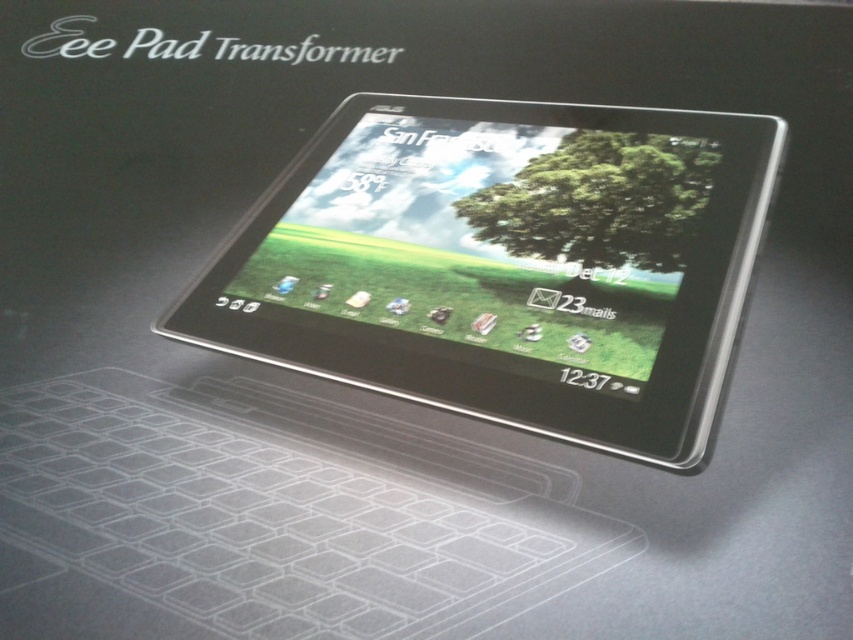
From the picture: Can you confirm if satin black tablet at center is positioned above green matte tree at center?

No, satin black tablet at center is not above green matte tree at center.

Is point (398, 179) farther from viewer compared to point (590, 212)?

Yes, point (398, 179) is behind point (590, 212).

The image size is (853, 640). In order to click on satin black tablet at center in this screenshot , I will do `click(506, 262)`.